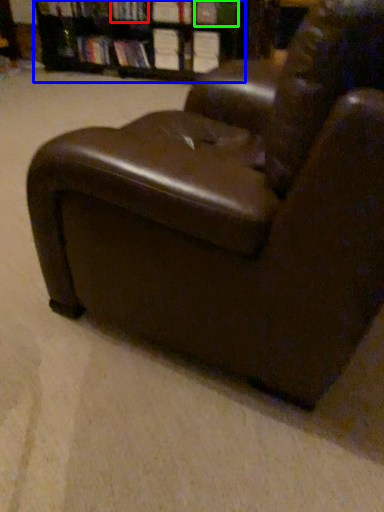
Question: Which object is the closest to the book (highlighted by a red box)? Choose among these: bookcase (highlighted by a blue box) or book (highlighted by a green box).

Choices:
 (A) bookcase
 (B) book

Answer: (A)